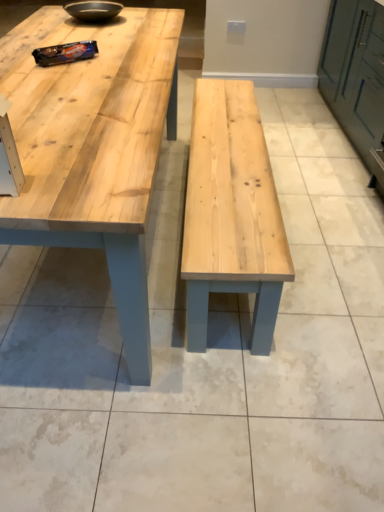
I want to click on vacant area that is situated to the right of matte black bowl at upper center, so click(x=150, y=22).